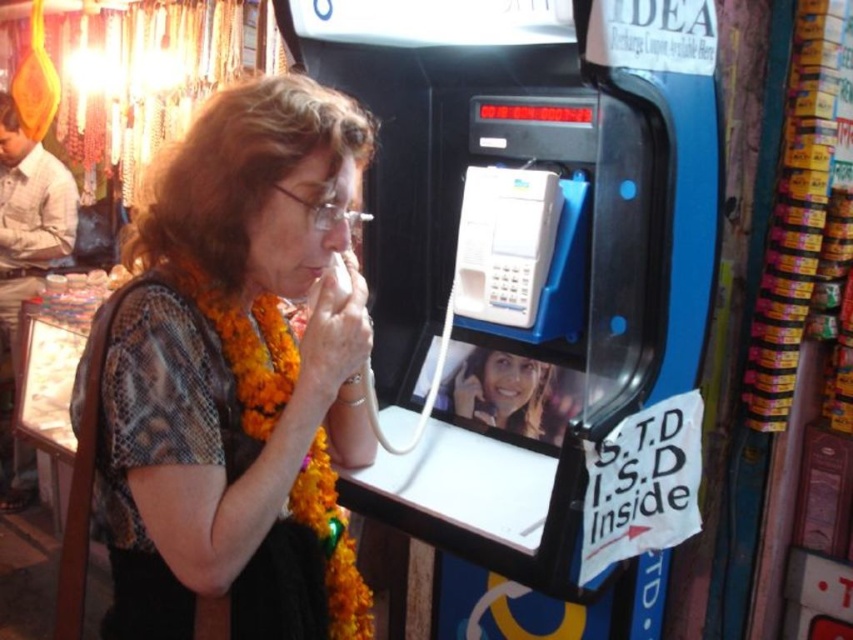
Between point (219, 148) and point (476, 243), which one is positioned behind?

The point (476, 243) is more distant.

Is matte brown blouse at center above white plastic payphone at center?

No.

Describe the element at coordinates (238, 376) in the screenshot. The image size is (853, 640). I see `matte brown blouse at center` at that location.

Find the location of `matte brown blouse at center`. matte brown blouse at center is located at coordinates (238, 376).